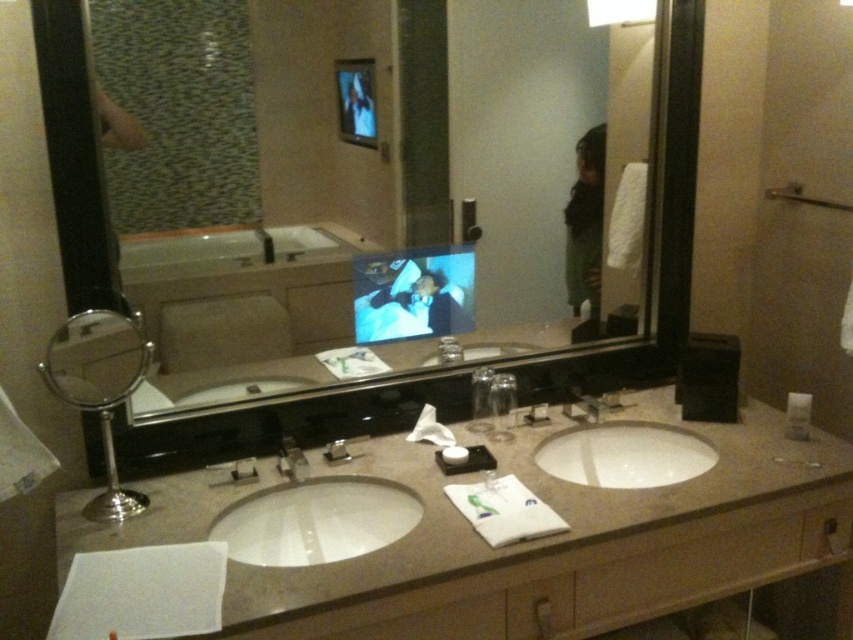
I want to click on clear glass mirror at center, so click(281, 220).

Image resolution: width=853 pixels, height=640 pixels. What do you see at coordinates (281, 220) in the screenshot?
I see `clear glass mirror at center` at bounding box center [281, 220].

Locate an element on the screen. clear glass mirror at center is located at coordinates (281, 220).

Is point (294, 97) farther from camera compared to point (560, 451)?

That is False.

Describe the element at coordinates (281, 220) in the screenshot. I see `clear glass mirror at center` at that location.

Is point (317, 337) closer to camera compared to point (682, 472)?

Yes, point (317, 337) is in front of point (682, 472).

The image size is (853, 640). I want to click on clear glass mirror at center, so click(281, 220).

Is point (247, 520) farther from camera compared to point (289, 442)?

That is False.

Is point (347, 550) positioned in front of point (297, 472)?

That is False.

The height and width of the screenshot is (640, 853). Find the location of `white glossy sink at center`. white glossy sink at center is located at coordinates (316, 522).